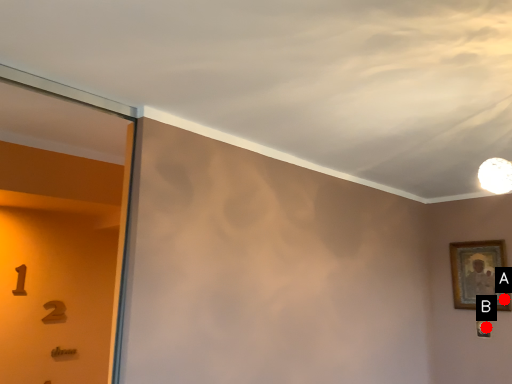
Question: Two points are circled on the image, labeled by A and B beside each circle. Which of the following is the farthest from the observer?

Choices:
 (A) A is further
 (B) B is further

Answer: (B)